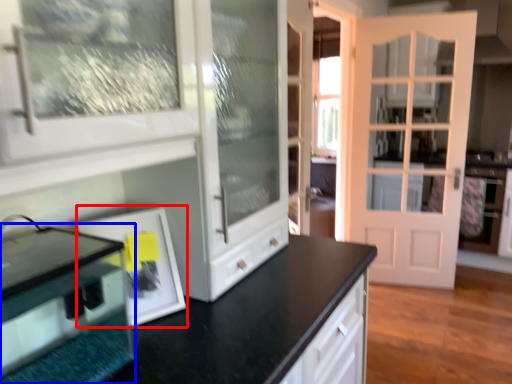
Question: Which object appears farthest to the camera in this image, picture frame (highlighted by a red box) or appliance (highlighted by a blue box)?

Choices:
 (A) picture frame
 (B) appliance

Answer: (A)